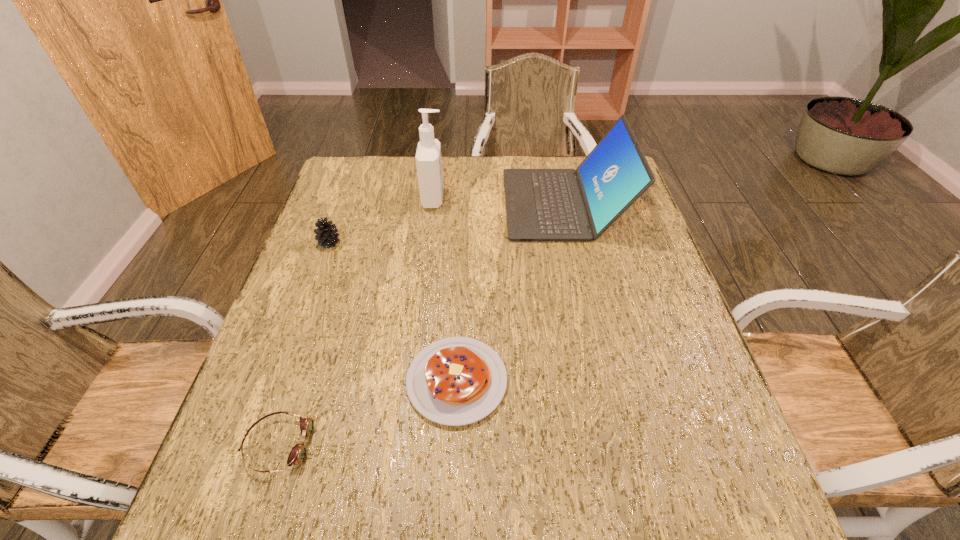
The image size is (960, 540). I want to click on vacant space located 0.370m on the right of the pinecone, so click(478, 242).

Locate an element on the screen. vacant area situated 0.120m on the left of the pancake is located at coordinates (348, 381).

This screenshot has width=960, height=540. I want to click on vacant space located 0.230m through the lenses of the goggles, so [x=437, y=445].

Find the location of a particular element. The width and height of the screenshot is (960, 540). cleansing agent that is at the far edge is located at coordinates (428, 155).

Where is `laptop computer situated at the far edge`? The height and width of the screenshot is (540, 960). laptop computer situated at the far edge is located at coordinates (541, 204).

You are a GUI agent. You are given a task and a screenshot of the screen. Output one action in this format:
    pyautogui.click(x=<x>, y=<y>)
    Task: Click on the pinecone that is at the left edge
    The height and width of the screenshot is (540, 960).
    Given the screenshot: What is the action you would take?
    pos(326,234)

Locate an element on the screen. Image resolution: width=960 pixels, height=540 pixels. goggles located in the left edge section of the desktop is located at coordinates (297, 455).

This screenshot has height=540, width=960. Find the location of `object at the right edge`. object at the right edge is located at coordinates (541, 204).

You are a GUI agent. You are given a task and a screenshot of the screen. Output one action in this format:
    pyautogui.click(x=<x>, y=<y>)
    Task: Click on the object that is positioned at the far right corner
    This screenshot has height=540, width=960.
    Given the screenshot: What is the action you would take?
    pyautogui.click(x=541, y=204)

The width and height of the screenshot is (960, 540). I want to click on vacant space at the far edge, so (483, 169).